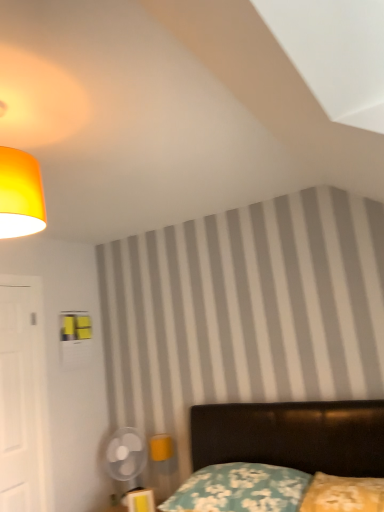
Question: Would you say transparent plastic fan at lower left is inside or outside floral fabric pillow at lower center, which ranks as the 1th pillow in left-to-right order?

Choices:
 (A) inside
 (B) outside

Answer: (B)

Question: In terms of size, does transparent plastic fan at lower left appear bigger or smaller than floral fabric pillow at lower center, which ranks as the 1th pillow in left-to-right order?

Choices:
 (A) big
 (B) small

Answer: (B)

Question: Considering the real-world distances, which object is farthest from the velvet black bed at lower right?

Choices:
 (A) white matte door at left
 (B) yellow fabric pillow at lower right, which is the first pillow in right-to-left order
 (C) floral fabric pillow at lower center, which ranks as the 2th pillow in right-to-left order
 (D) matte yellow lampshade at upper left
 (E) transparent plastic fan at lower left

Answer: (D)

Question: Which object is positioned closest to the matte yellow lampshade at upper left?

Choices:
 (A) white matte door at left
 (B) floral fabric pillow at lower center, which ranks as the 1th pillow in left-to-right order
 (C) velvet black bed at lower right
 (D) transparent plastic fan at lower left
 (E) yellow fabric pillow at lower right, the second pillow in the left-to-right sequence

Answer: (A)